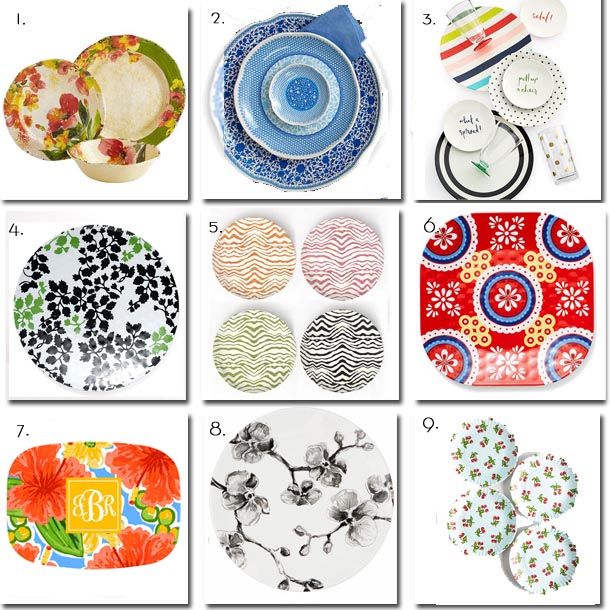
The width and height of the screenshot is (610, 610). In order to click on matching bowl with flowers in this screenshot , I will do `click(107, 155)`.